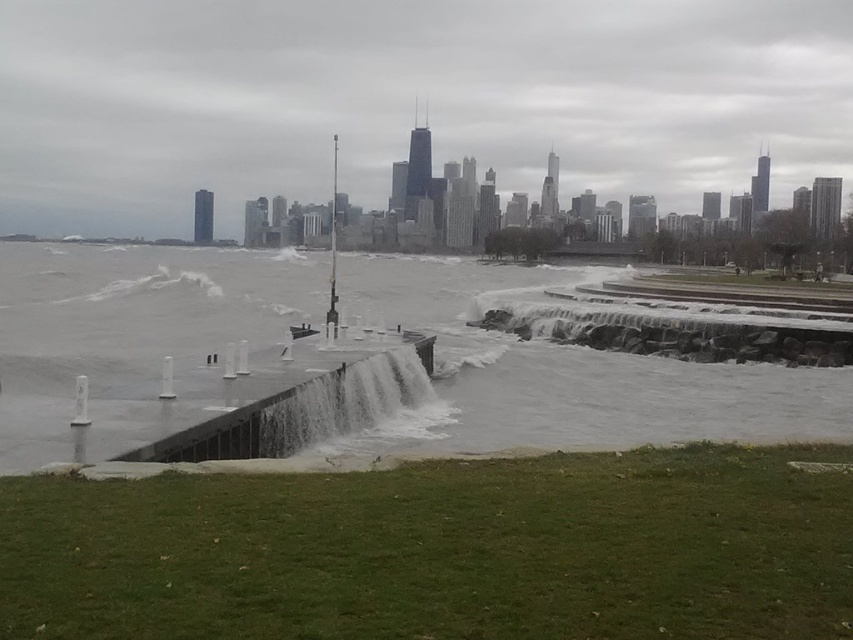
Is point (50, 248) positioned behind point (259, 436)?

That is True.

Does clear concrete water at center come in front of gray concrete waterfall at center?

Yes, clear concrete water at center is in front of gray concrete waterfall at center.

The height and width of the screenshot is (640, 853). Find the location of `clear concrete water at center`. clear concrete water at center is located at coordinates (548, 374).

The image size is (853, 640). Identify the location of clear concrete water at center. (548, 374).